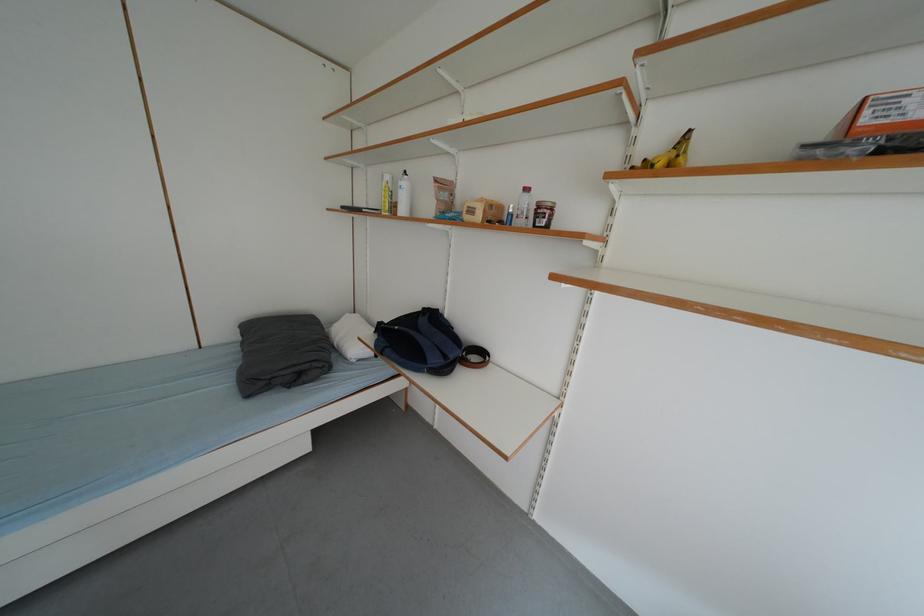
What are the coordinates of `blue backpack` in the screenshot? It's located at (419, 342).